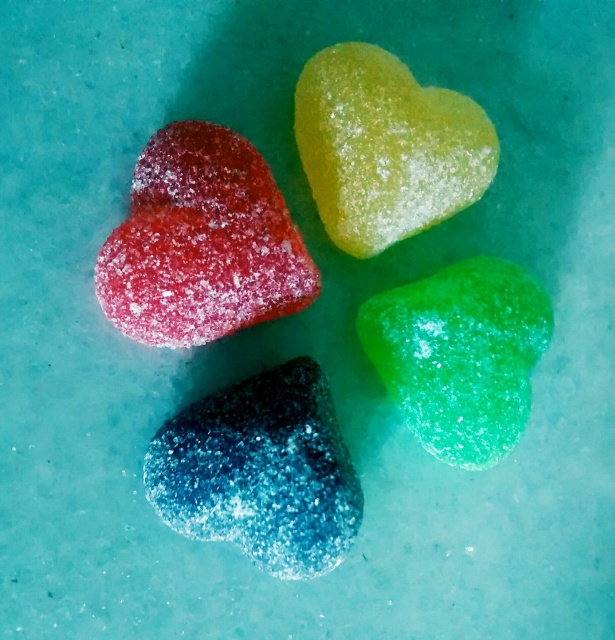
You are arranging candies on a table and want to place a new candy between the blue glittery heart at bottom left and the translucent yellow heart at upper center. Based on their positions, where should you place the new candy?

The blue glittery heart at bottom left is located below the translucent yellow heart at upper center, so you should place the new candy between them in the middle area between the two candies.

You are holding a small toy that is 1.2 meters long and want to place it on the teal surface where the point at point (253,244) is located. Can you fit the toy on the surface without overlapping any candies?

The point at point (253,244) is 1.36 meters away from the viewer. Since the toy is 1.2 meters long, it can be placed on the teal surface at that point without overlapping any candies as there is enough space.

You are a quality inspector checking the placement of candies on a teal surface. The candies must be placed within a 0.4 meter radius from the center point. The center of the teal surface is at point 0.5, 0.5. Is the matte red heart at upper left within the required radius?

The matte red heart at upper left is located at point (200, 243). The distance from the center point (307, 320) is sqrt of squared differences in x and y coordinates. Calculating sqrt of squared difference between 0.5 and 0.380 is 0.12, squared is 0.0144. Squared difference in y is 0.5 minus 0.328 is 0.172, squared is 0.029584. Sum is 0.043984. Square root of that is approximately 0.2097 meters. Since 0.2097 is less than 0.4, it is within the required radius.